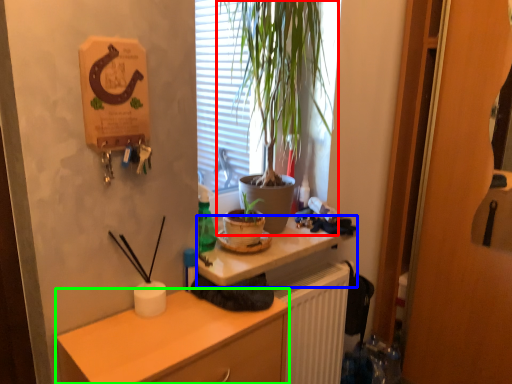
Question: Which object is positioned closest to houseplant (highlighted by a red box)? Select from desk (highlighted by a blue box) and cabinetry (highlighted by a green box).

Choices:
 (A) desk
 (B) cabinetry

Answer: (A)